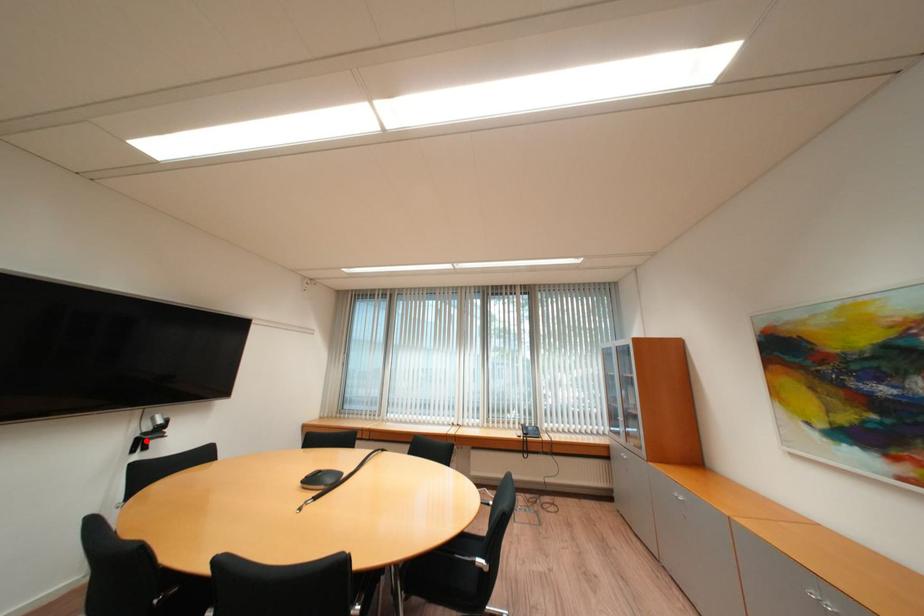
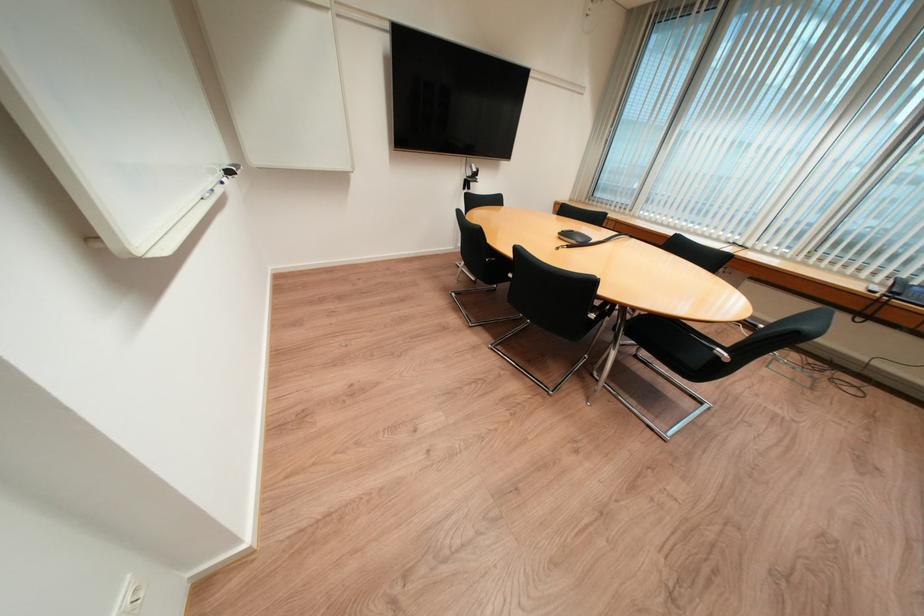
Question: I am providing you with two images of the same scene from different viewpoints. A red point is marked on the first image. Can you still see the location of the red point in image 2?

Choices:
 (A) Yes
 (B) No

Answer: (A)